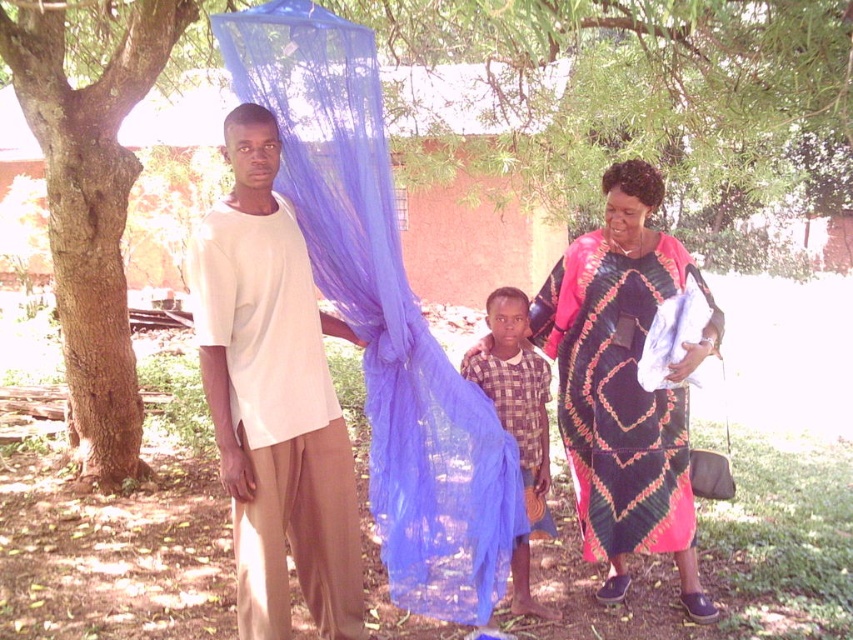
Which is more to the left, white matte t-shirt at center or printed cotton dress at center?

From the viewer's perspective, white matte t-shirt at center appears more on the left side.

Is white matte t-shirt at center to the right of printed cotton dress at center from the viewer's perspective?

In fact, white matte t-shirt at center is to the left of printed cotton dress at center.

At what (x,y) coordinates should I click in order to perform the action: click on white matte t-shirt at center. Please return your answer as a coordinate pair (x, y). The height and width of the screenshot is (640, 853). Looking at the image, I should click on (274, 397).

Image resolution: width=853 pixels, height=640 pixels. I want to click on white matte t-shirt at center, so click(x=274, y=397).

In the scene shown: Who is taller, printed cotton dress at center or brown rough bark tree at left?

brown rough bark tree at left

Find the location of `printed cotton dress at center`. printed cotton dress at center is located at coordinates (624, 385).

Describe the element at coordinates (624, 385) in the screenshot. I see `printed cotton dress at center` at that location.

Where is `printed cotton dress at center`? The image size is (853, 640). printed cotton dress at center is located at coordinates [624, 385].

Is white matte t-shirt at center to the right of brown rough bark tree at left from the viewer's perspective?

Correct, you'll find white matte t-shirt at center to the right of brown rough bark tree at left.

Is white matte t-shirt at center taller than brown rough bark tree at left?

In fact, white matte t-shirt at center may be shorter than brown rough bark tree at left.

This screenshot has width=853, height=640. Describe the element at coordinates (274, 397) in the screenshot. I see `white matte t-shirt at center` at that location.

The width and height of the screenshot is (853, 640). Identify the location of white matte t-shirt at center. (274, 397).